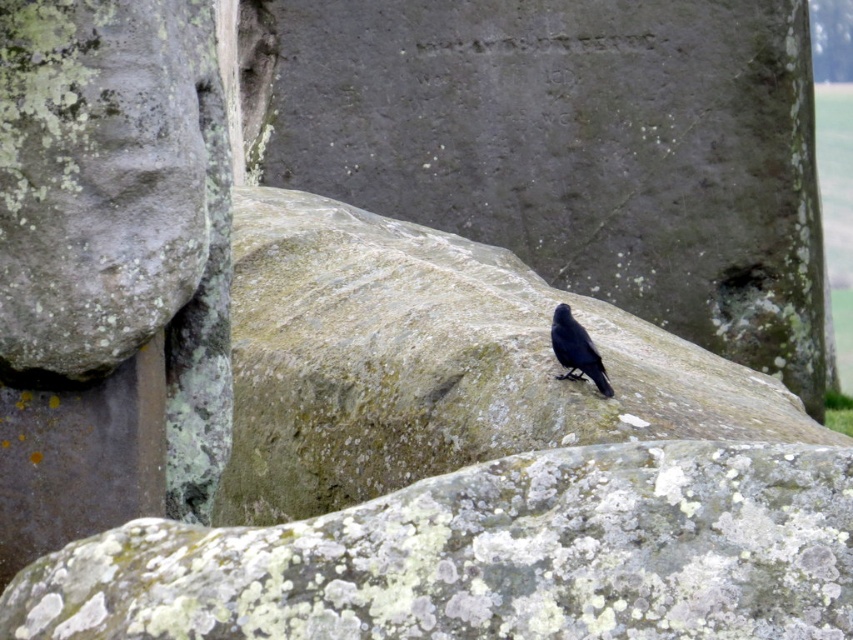
Is smooth gray rock at center thinner than shiny black crow at center?

In fact, smooth gray rock at center might be wider than shiny black crow at center.

Which is below, smooth gray rock at center or shiny black crow at center?

Positioned lower is smooth gray rock at center.

What are the coordinates of `smooth gray rock at center` in the screenshot? It's located at (434, 364).

Locate an element on the screen. Image resolution: width=853 pixels, height=640 pixels. smooth gray rock at center is located at coordinates (434, 364).

Does point (618, 529) come closer to viewer compared to point (570, 321)?

Yes, point (618, 529) is in front of point (570, 321).

Between point (643, 545) and point (589, 362), which one is positioned behind?

The point (589, 362) is more distant.

Which is in front, point (178, 609) or point (582, 368)?

Point (178, 609) is more forward.

The image size is (853, 640). I want to click on speckled gray rock at center, so click(x=489, y=557).

Which is in front, point (485, 600) or point (502, 340)?

Point (485, 600)

Does speckled gray rock at center have a lesser height compared to smooth gray rock at center?

Yes, speckled gray rock at center is shorter than smooth gray rock at center.

Which is behind, point (334, 618) or point (305, 307)?

The point (305, 307) is more distant.

Find the location of `speckled gray rock at center`. speckled gray rock at center is located at coordinates (489, 557).